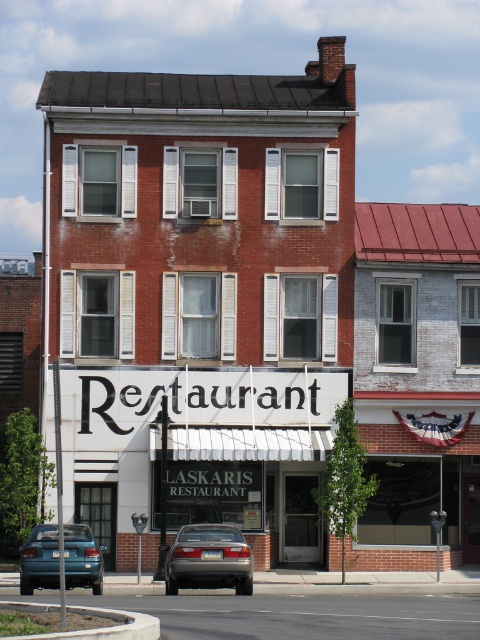
You are a delivery driver who needs to park your vehicle between the satin silver sedan at center and the teal matte car at lower left. Your vehicle is 4.5 meters long. Can you fit your car in the space between them?

The satin silver sedan at center is larger in size than teal matte car at lower left, but the exact distance between them isn not provided. Without knowing the available space, it is impossible to determine if your 4.5 meter vehicle can fit between them.

You are a delivery driver who needs to park your vehicle between the satin silver sedan at center and the teal matte car at lower left. Is there enough space between them to fit your 5.5 feet wide delivery van?

The satin silver sedan at center is positioned on the right side of teal matte car at lower left. Since the exact distance between them isn not provided, it is unclear if there is sufficient space for a 5.5 feet wide delivery van. Please check the available space physically before attempting to park.

You are a delivery person who needs to park your vehicle in front of the restaurant. You have a delivery van that is 2 meters long. The parking space between the satin silver sedan at center and the teal matte car at lower left is 2.5 meters. Can your van fit in that space?

The parking space between the satin silver sedan at center and the teal matte car at lower left is 2.5 meters. Since your van is 2 meters long, it can fit in the space.